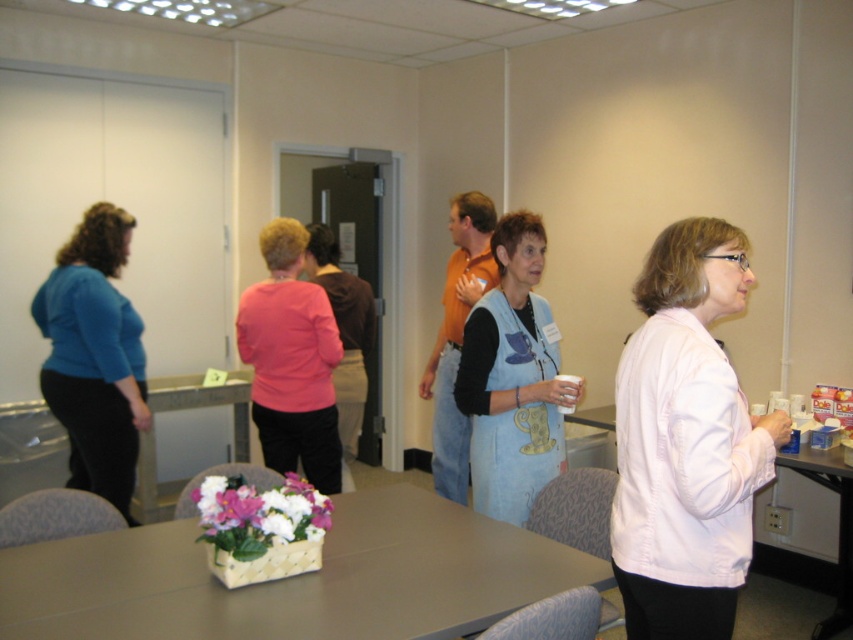
Question: Based on their relative distances, which object is nearer to the pink matte sweater at center?

Choices:
 (A) smooth plastic table at lower right
 (B) blue matte shirt at left
 (C) smooth beige table at center

Answer: (B)

Question: Is smooth beige table at center behind light blue denim vest at center?

Choices:
 (A) no
 (B) yes

Answer: (A)

Question: Estimate the real-world distances between objects in this image. Which object is closer to the white matte shirt at right?

Choices:
 (A) blue matte shirt at left
 (B) smooth plastic table at lower right
 (C) smooth beige table at center
 (D) pink matte sweater at center

Answer: (C)

Question: Can you confirm if light blue denim vest at center is thinner than blue matte shirt at left?

Choices:
 (A) yes
 (B) no

Answer: (A)

Question: Among these objects, which one is nearest to the camera?

Choices:
 (A) white matte shirt at right
 (B) smooth beige table at center
 (C) pink matte sweater at center

Answer: (A)

Question: Does white matte shirt at right come in front of blue matte shirt at left?

Choices:
 (A) yes
 (B) no

Answer: (A)